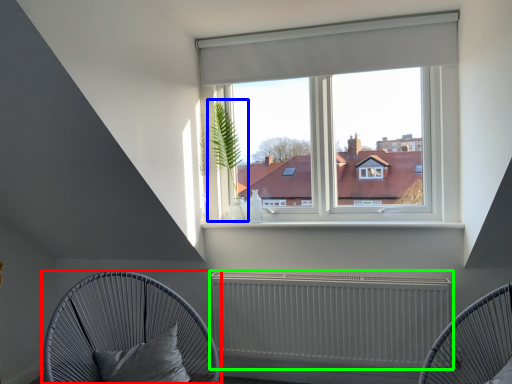
Question: Considering the real-world distances, which object is closest to furniture (highlighted by a red box)? plant (highlighted by a blue box) or radiator (highlighted by a green box).

Choices:
 (A) plant
 (B) radiator

Answer: (B)